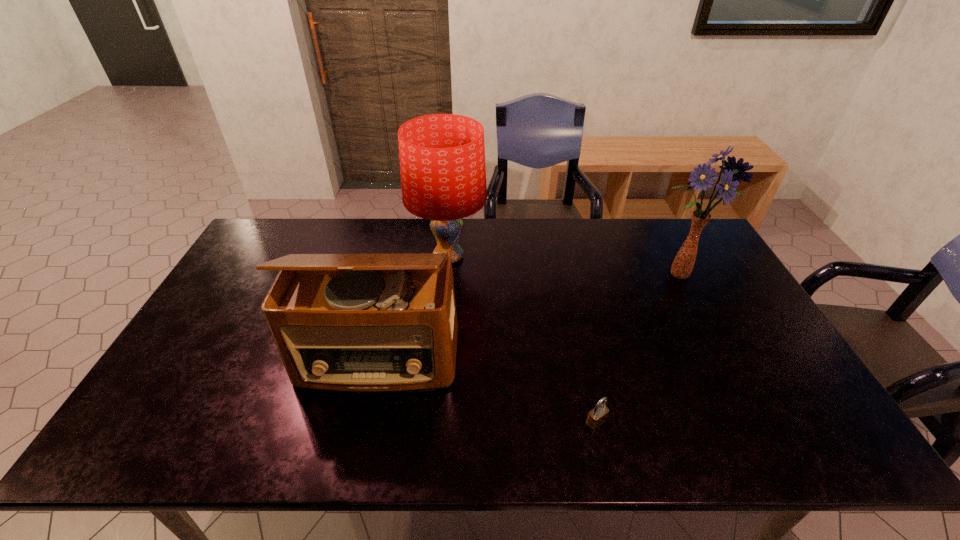
Identify the location of free space in the image that satisfies the following two spatial constraints: 1. on the front-facing side of the nearest object; 2. on the left side of the lampshade. The width and height of the screenshot is (960, 540). (434, 422).

At what (x,y) coordinates should I click in order to perform the action: click on vacant point that satisfies the following two spatial constraints: 1. on the front-facing side of the lampshade; 2. on the right side of the flower arrangement. Please return your answer as a coordinate pair (x, y). Looking at the image, I should click on [446, 275].

Locate an element on the screen. The image size is (960, 540). vacant region that satisfies the following two spatial constraints: 1. on the back side of the nearest object; 2. on the front-facing side of the lampshade is located at coordinates (560, 256).

You are a GUI agent. You are given a task and a screenshot of the screen. Output one action in this format:
    pyautogui.click(x=<x>, y=<y>)
    Task: Click on the vacant space that satisfies the following two spatial constraints: 1. on the front panel of the third tallest object; 2. on the left side of the padlock
    The height and width of the screenshot is (540, 960).
    Given the screenshot: What is the action you would take?
    pyautogui.click(x=365, y=422)

At what (x,y) coordinates should I click in order to perform the action: click on vacant space that satisfies the following two spatial constraints: 1. on the front panel of the nearest object; 2. on the left side of the radio receiver. Please return your answer as a coordinate pair (x, y). The height and width of the screenshot is (540, 960). Looking at the image, I should click on (365, 422).

Identify the location of free location that satisfies the following two spatial constraints: 1. on the front-facing side of the nearest object; 2. on the right side of the lampshade. (434, 422).

Where is `free location that satisfies the following two spatial constraints: 1. on the front-facing side of the lampshade; 2. on the front panel of the third farthest object`? free location that satisfies the following two spatial constraints: 1. on the front-facing side of the lampshade; 2. on the front panel of the third farthest object is located at coordinates (440, 360).

Locate an element on the screen. This screenshot has height=540, width=960. vacant space that satisfies the following two spatial constraints: 1. on the back side of the nearest object; 2. on the right side of the flower arrangement is located at coordinates (564, 275).